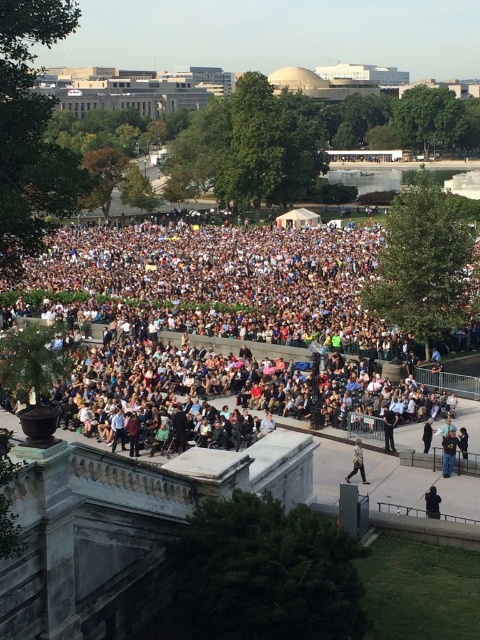
Please look at the image. There is a point marked at coordinates (231, 317). Which object from the list below is located at that point? The options are white cloth crowd at center, tiered stone steps, buildings with dome, trees.

The point marked at coordinates (231, 317) corresponds to the white cloth crowd at center.

You are a photographer at the event and want to capture both the white cloth crowd at center and the black fabric jacket at center in a single shot. Given that your camera has a maximum focus range of 50 meters, will you be able to focus on both subjects simultaneously?

The white cloth crowd at center is 50.76 meters from the black fabric jacket at center. Since the distance between them exceeds the camera maximum focus range of 50 meters, you cannot focus on both subjects simultaneously.

You are a photographer at the event and need to capture a photo that includes both the white cloth crowd at center and the black leather jacket at lower right. Given that your camera has a maximum focus range of 150 feet, will you be able to fit both subjects in the same frame without moving closer?

The distance between the white cloth crowd at center and the black leather jacket at lower right is 167.40 feet. Since your camera can only focus up to 150 feet, you won not be able to capture both subjects in the same frame without moving closer.